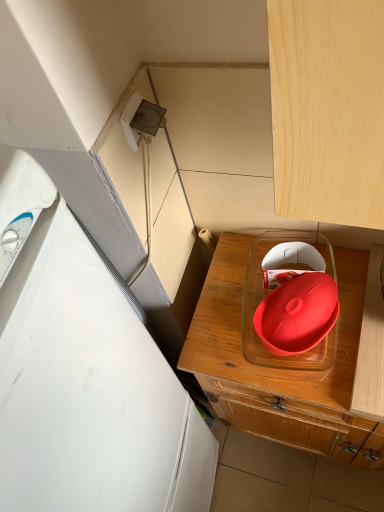
Question: Considering the relative sizes of rubberized red lid at center and white plastic refrigerator at left in the image provided, is rubberized red lid at center shorter than white plastic refrigerator at left?

Choices:
 (A) yes
 (B) no

Answer: (A)

Question: Considering the relative positions of rubberized red lid at center and white plastic refrigerator at left in the image provided, is rubberized red lid at center to the right of white plastic refrigerator at left from the viewer's perspective?

Choices:
 (A) no
 (B) yes

Answer: (B)

Question: Is rubberized red lid at center positioned behind white plastic refrigerator at left?

Choices:
 (A) no
 (B) yes

Answer: (B)

Question: Could you tell me if rubberized red lid at center is turned towards white plastic refrigerator at left?

Choices:
 (A) no
 (B) yes

Answer: (A)

Question: Can you confirm if rubberized red lid at center is bigger than white plastic refrigerator at left?

Choices:
 (A) yes
 (B) no

Answer: (B)

Question: Relative to matte plastic tray at center, is rubberized red lid at center in front or behind?

Choices:
 (A) behind
 (B) front

Answer: (A)

Question: From the image's perspective, relative to matte plastic tray at center, is rubberized red lid at center above or below?

Choices:
 (A) below
 (B) above

Answer: (B)

Question: From a real-world perspective, is rubberized red lid at center above or below matte plastic tray at center?

Choices:
 (A) above
 (B) below

Answer: (A)

Question: Is point (271, 354) closer or farther from the camera than point (268, 384)?

Choices:
 (A) farther
 (B) closer

Answer: (A)

Question: In terms of size, does white plastic refrigerator at left appear bigger or smaller than rubberized red lid at center?

Choices:
 (A) small
 (B) big

Answer: (B)

Question: Relative to rubberized red lid at center, is white plastic refrigerator at left in front or behind?

Choices:
 (A) behind
 (B) front

Answer: (B)

Question: Considering the positions of white plastic refrigerator at left and rubberized red lid at center in the image, is white plastic refrigerator at left taller or shorter than rubberized red lid at center?

Choices:
 (A) tall
 (B) short

Answer: (A)

Question: Considering the positions of point (211, 454) and point (271, 251), is point (211, 454) closer or farther from the camera than point (271, 251)?

Choices:
 (A) farther
 (B) closer

Answer: (A)

Question: Is matte plastic tray at center wider or thinner than white plastic refrigerator at left?

Choices:
 (A) wide
 (B) thin

Answer: (A)

Question: Considering the positions of point (354, 414) and point (54, 322), is point (354, 414) closer or farther from the camera than point (54, 322)?

Choices:
 (A) farther
 (B) closer

Answer: (A)